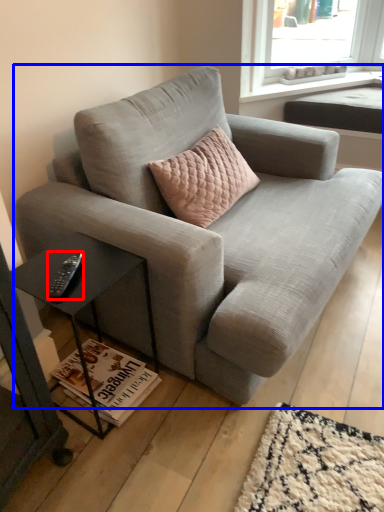
Question: Which of the following is the closest to the observer, remote (highlighted by a red box) or studio couch (highlighted by a blue box)?

Choices:
 (A) remote
 (B) studio couch

Answer: (B)